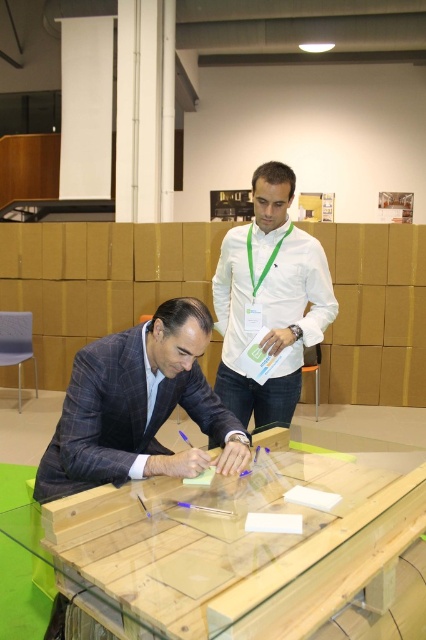
Question: Which object appears farthest from the camera in this image?

Choices:
 (A) plaid wool suit at lower left
 (B) wooden table at center

Answer: (A)

Question: Is plaid wool suit at lower left wider than white smooth shirt at upper center?

Choices:
 (A) yes
 (B) no

Answer: (A)

Question: Among these objects, which one is farthest from the camera?

Choices:
 (A) white smooth shirt at upper center
 (B) plaid wool suit at lower left

Answer: (A)

Question: Which of the following is the farthest from the observer?

Choices:
 (A) white smooth shirt at upper center
 (B) wooden table at center
 (C) plaid wool suit at lower left

Answer: (A)

Question: Is wooden table at center to the left of plaid wool suit at lower left from the viewer's perspective?

Choices:
 (A) no
 (B) yes

Answer: (A)

Question: Is wooden table at center to the right of plaid wool suit at lower left from the viewer's perspective?

Choices:
 (A) no
 (B) yes

Answer: (B)